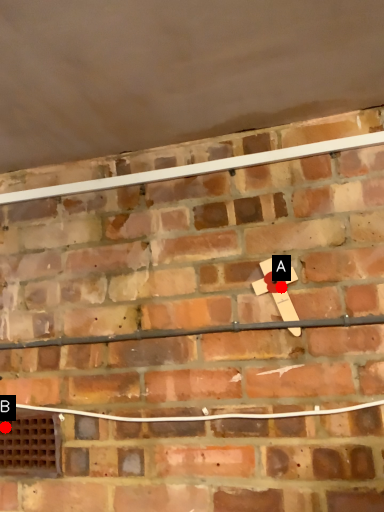
Question: Two points are circled on the image, labeled by A and B beside each circle. Which point is closer to the camera taking this photo?

Choices:
 (A) A is closer
 (B) B is closer

Answer: (A)